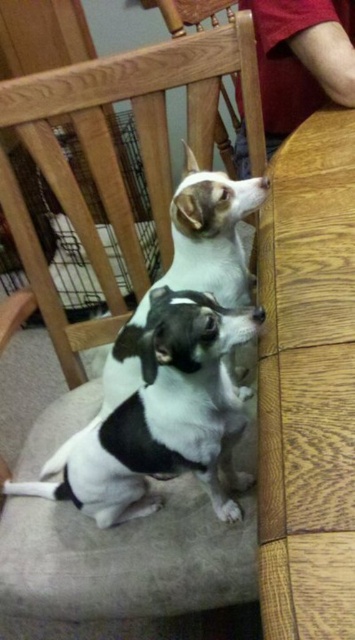
You are taking a photo of the two dogs sitting on the chair. You want to focus on the dog that is closer to the camera. Which point should you focus on, point (350, 380) or point (183, 400)?

You should focus on point (350, 380) because it is closer to the camera than point (183, 400).

You are standing in front of the wooden chair at center and want to place a small toy exactly at point (116, 156). Can you confirm if this point is on the wooden chair at center?

Yes, the point 0.247, 0.327 is on the wooden chair at center, so the toy can be placed there.